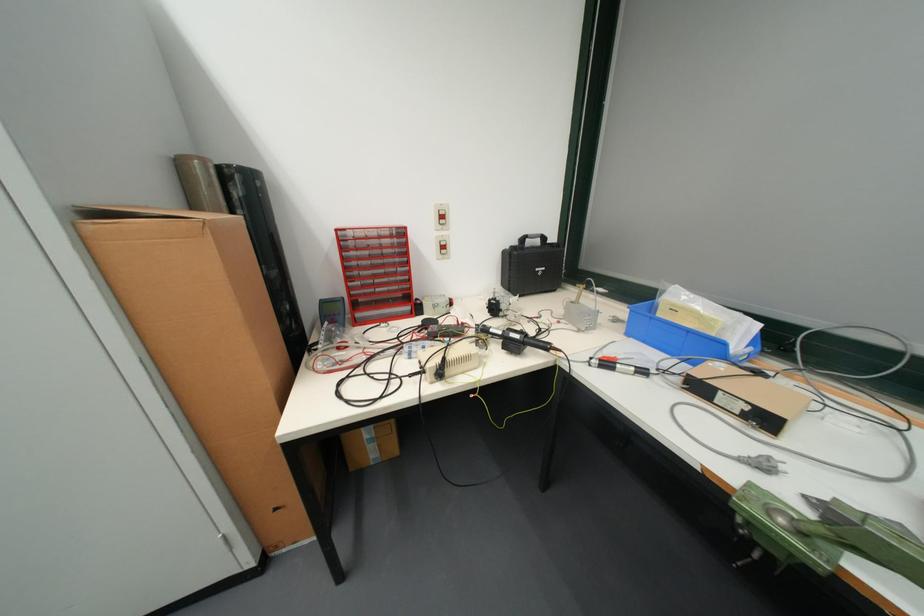
Where would you turn the multimeter dial? Please return your answer as a coordinate pair (x, y).

(332, 310)